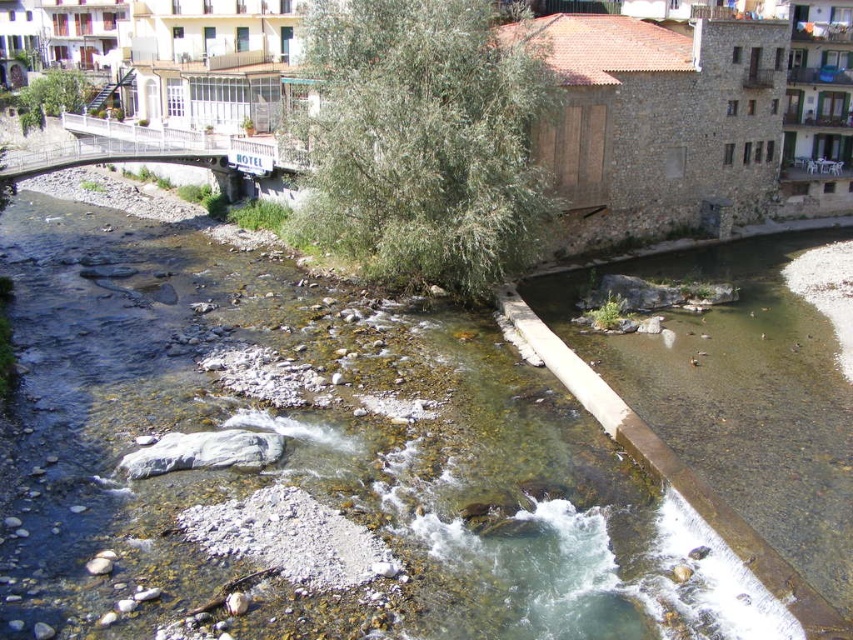
You are standing at the point labeled point (314, 464) in the image. What do you see directly in front of you?

You see clear water at center directly in front of you at point (314, 464).